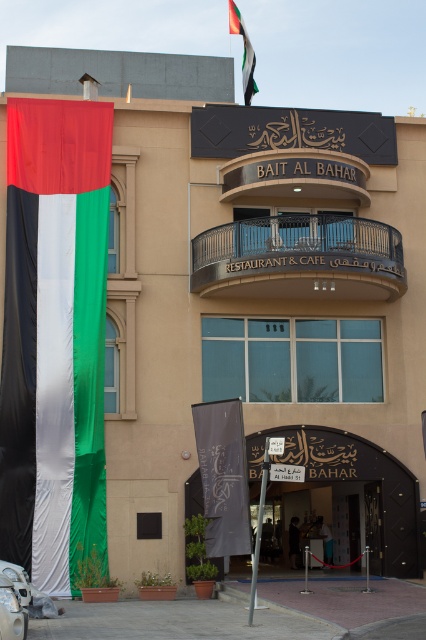
In the scene shown: You are standing in front of the BAIT AL BAHAR building and want to take a photo of both the metallic wrought iron balcony at center and the metallic pole at center. Which object should you focus on first to ensure both are in the frame?

You should focus on the metallic wrought iron balcony at center first because it is closer to you than the metallic pole at center, so adjusting the camera to include it will also capture the pole behind it.

You are a visitor standing at the entrance of BAIT AL BAHAR. You see the silky fabric flag at left and the metallic wrought iron balcony at center. Which object is closer to you?

The silky fabric flag at left is closer to you because it is in front of the metallic wrought iron balcony at center.

You are a visitor standing in front of the BAIT AL BAHAR building. You notice two metallic structures in the center area. Which one is shorter between the metallic wrought iron balcony at center and the metallic pole at center?

The metallic wrought iron balcony at center is shorter than the metallic pole at center.